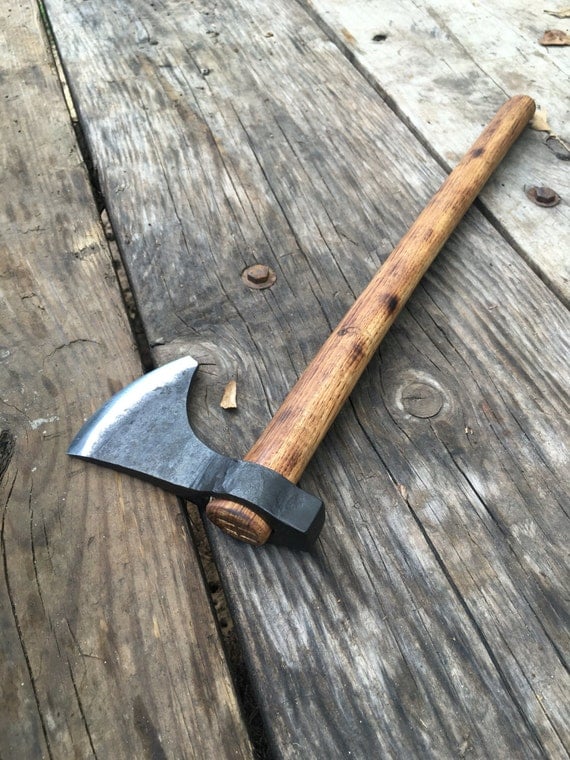
At what (x,y) coordinates should I click in order to perform the action: click on knot in wood. Please return your answer as a coordinate pair (x, y). Image resolution: width=570 pixels, height=760 pixels. Looking at the image, I should click on (415, 407), (1, 458), (382, 36).